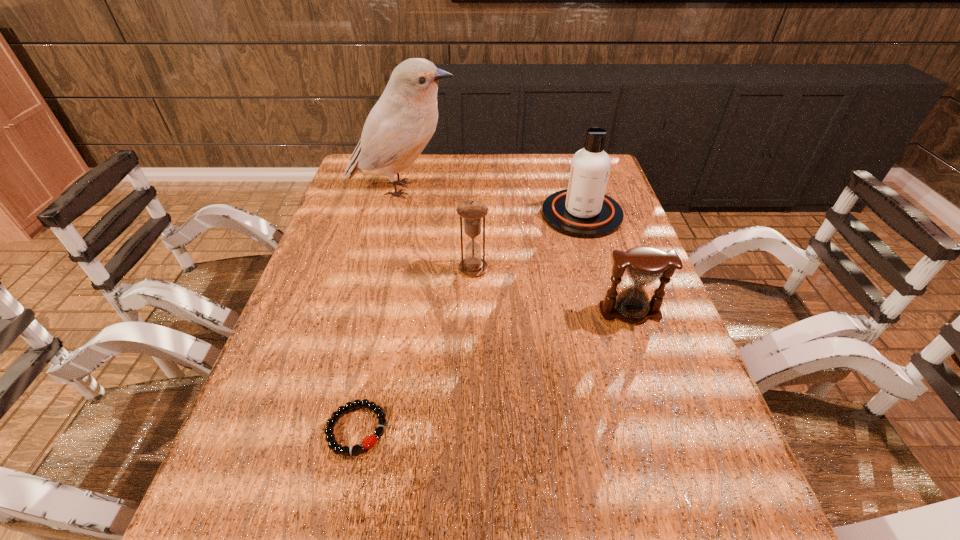
Locate an element on the screen. The height and width of the screenshot is (540, 960). the tallest object is located at coordinates (402, 122).

I want to click on the second tallest object, so click(x=583, y=210).

Locate an element on the screen. The image size is (960, 540). the left hourglass is located at coordinates (472, 211).

This screenshot has width=960, height=540. I want to click on the farther hourglass, so click(472, 211).

This screenshot has width=960, height=540. I want to click on the right hourglass, so click(x=644, y=265).

The image size is (960, 540). I want to click on the fourth farthest object, so click(644, 265).

This screenshot has width=960, height=540. I want to click on the shortest object, so click(x=367, y=443).

Find the location of a particular element. This screenshot has height=540, width=960. the nearest object is located at coordinates (367, 443).

I want to click on vacant space located on the face of the tallest object, so click(x=485, y=190).

This screenshot has height=540, width=960. Find the location of `vacant space positioned 0.180m on the back of the fourth shortest object`. vacant space positioned 0.180m on the back of the fourth shortest object is located at coordinates (567, 165).